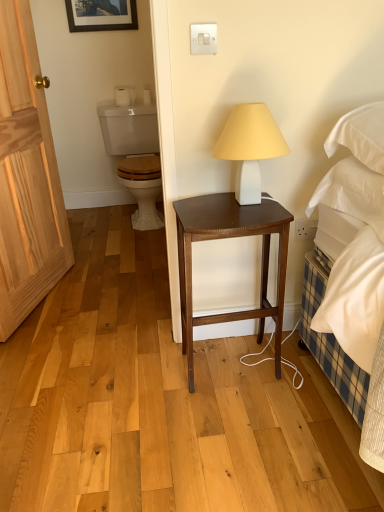
Find the location of a particular element. This screenshot has width=384, height=512. free space underneath natural wood door at left (from a real-world perspective) is located at coordinates (45, 306).